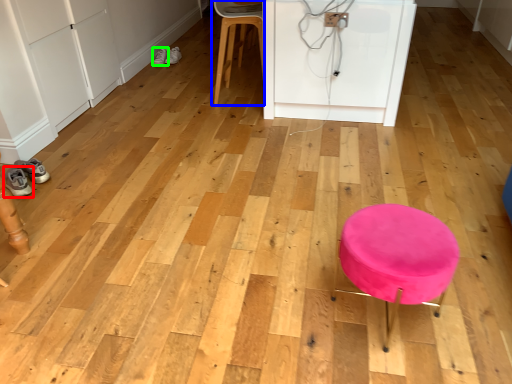
Question: Based on their relative distances, which object is nearer to footwear (highlighted by a red box)? Choose from chair (highlighted by a blue box) and footwear (highlighted by a green box).

Choices:
 (A) chair
 (B) footwear

Answer: (A)